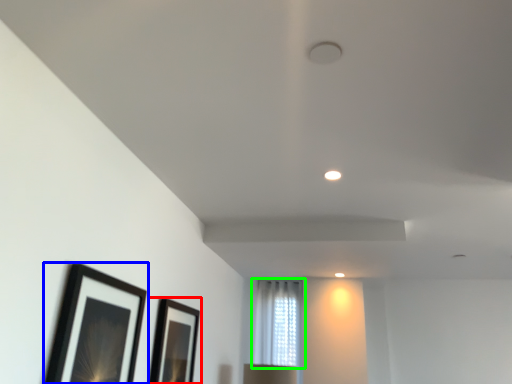
Question: Which object is the farthest from picture frame (highlighted by a red box)? Choose among these: picture frame (highlighted by a blue box) or window (highlighted by a green box).

Choices:
 (A) picture frame
 (B) window

Answer: (B)